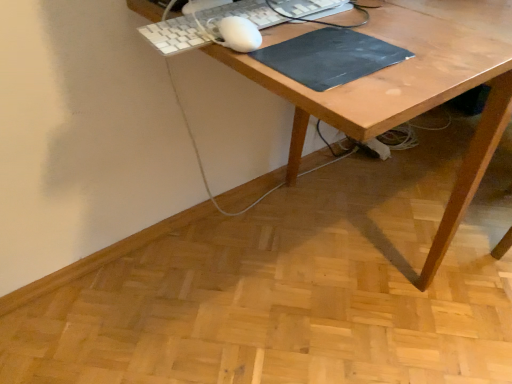
Question: Is white plastic keyboard at upper center facing away from black matte mousepad at center?

Choices:
 (A) yes
 (B) no

Answer: (B)

Question: From a real-world perspective, is white plastic keyboard at upper center located higher than black matte mousepad at center?

Choices:
 (A) no
 (B) yes

Answer: (B)

Question: Is white plastic keyboard at upper center wider than black matte mousepad at center?

Choices:
 (A) no
 (B) yes

Answer: (A)

Question: Can you confirm if white plastic keyboard at upper center is taller than black matte mousepad at center?

Choices:
 (A) yes
 (B) no

Answer: (A)

Question: Would you consider white plastic keyboard at upper center to be distant from black matte mousepad at center?

Choices:
 (A) no
 (B) yes

Answer: (A)

Question: From the image's perspective, is white plastic keyboard at upper center below black matte mousepad at center?

Choices:
 (A) yes
 (B) no

Answer: (B)

Question: Is the depth of black matte mousepad at center greater than that of wooden desk at center?

Choices:
 (A) yes
 (B) no

Answer: (A)

Question: Would you consider black matte mousepad at center to be distant from wooden desk at center?

Choices:
 (A) yes
 (B) no

Answer: (B)

Question: Can you confirm if black matte mousepad at center is positioned to the right of wooden desk at center?

Choices:
 (A) yes
 (B) no

Answer: (B)

Question: Does black matte mousepad at center lie in front of wooden desk at center?

Choices:
 (A) yes
 (B) no

Answer: (B)

Question: From the image's perspective, is black matte mousepad at center located above wooden desk at center?

Choices:
 (A) no
 (B) yes

Answer: (A)

Question: Can you confirm if black matte mousepad at center is bigger than wooden desk at center?

Choices:
 (A) yes
 (B) no

Answer: (B)

Question: Is wooden desk at center positioned beyond the bounds of white plastic keyboard at upper center?

Choices:
 (A) yes
 (B) no

Answer: (A)